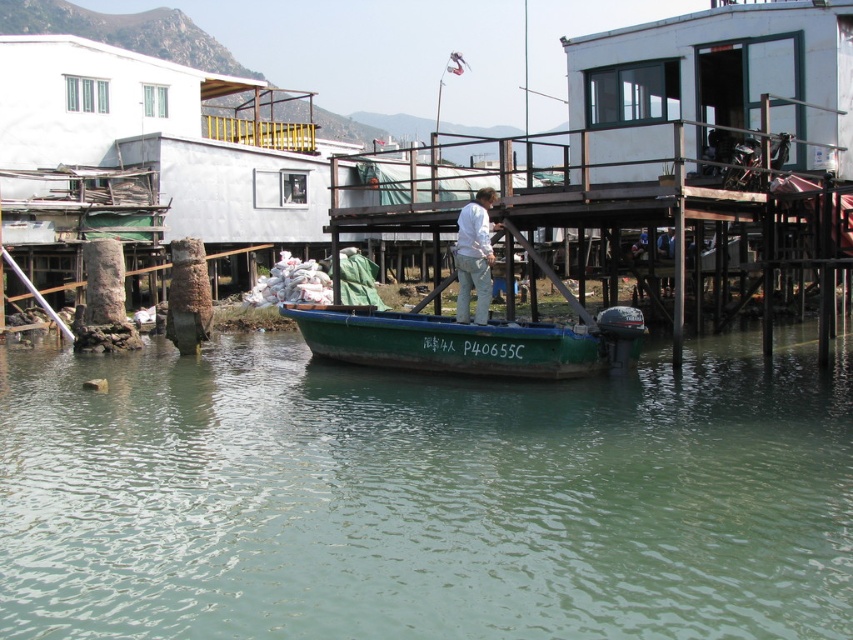
Question: Based on their relative distances, which object is farther from the white matte shirt at center?

Choices:
 (A) green matte boat at center
 (B) green matte water at center

Answer: (B)

Question: Estimate the real-world distances between objects in this image. Which object is closer to the green matte boat at center?

Choices:
 (A) white matte shirt at center
 (B) green matte water at center

Answer: (A)

Question: Estimate the real-world distances between objects in this image. Which object is closer to the green matte water at center?

Choices:
 (A) green matte boat at center
 (B) white matte shirt at center

Answer: (A)

Question: Is green matte water at center thinner than green matte boat at center?

Choices:
 (A) yes
 (B) no

Answer: (B)

Question: Does green matte water at center appear on the right side of white matte shirt at center?

Choices:
 (A) no
 (B) yes

Answer: (A)

Question: Does green matte water at center have a smaller size compared to white matte shirt at center?

Choices:
 (A) no
 (B) yes

Answer: (A)